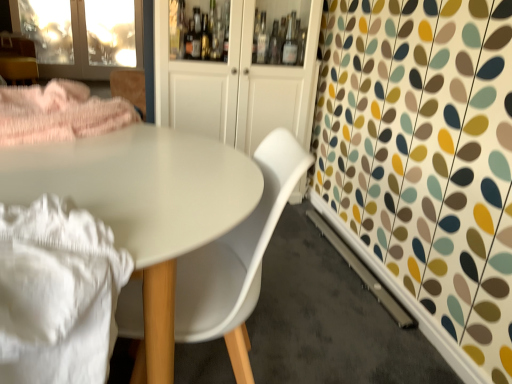
Question: Is white glossy cabinet at center situated inside matte pink fabric at upper left or outside?

Choices:
 (A) outside
 (B) inside

Answer: (A)

Question: Based on their sizes in the image, would you say white glossy cabinet at center is bigger or smaller than matte pink fabric at upper left?

Choices:
 (A) small
 (B) big

Answer: (B)

Question: Considering the real-world distances, which object is closest to the white glossy cabinet at center?

Choices:
 (A) white cotton blanket at lower left
 (B) transparent glass screen door at upper left
 (C) matte pink fabric at upper left
 (D) white matte chair at center
 (E) matte white table at center

Answer: (E)

Question: Estimate the real-world distances between objects in this image. Which object is farther from the white matte chair at center?

Choices:
 (A) white cotton blanket at lower left
 (B) transparent glass screen door at upper left
 (C) matte white table at center
 (D) matte pink fabric at upper left
 (E) white glossy cabinet at center

Answer: (B)